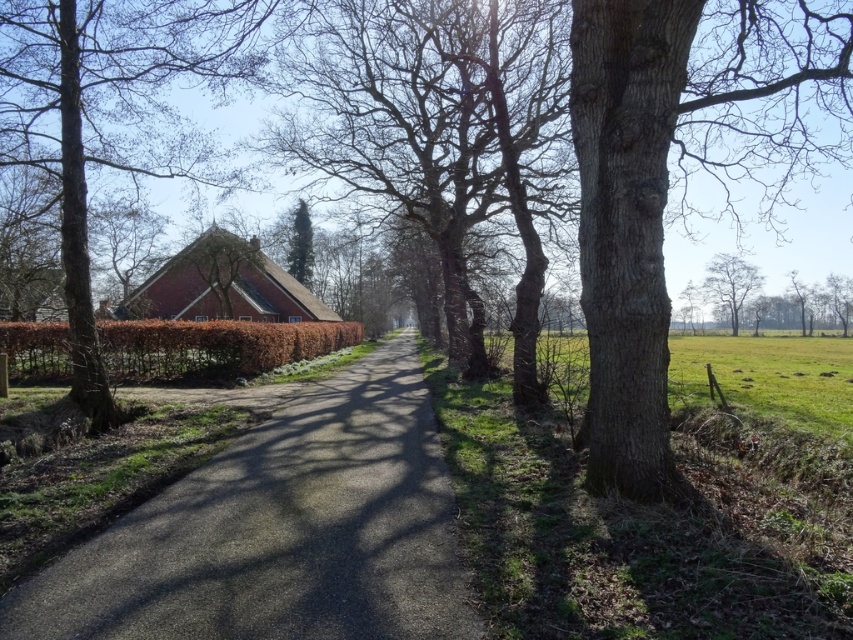
Image resolution: width=853 pixels, height=640 pixels. Identify the location of bare bark tree at center. (439, 129).

Who is lower down, bare bark tree at center or smooth bark tree at upper right?

smooth bark tree at upper right is lower down.

Who is more forward, (483, 205) or (727, 292)?

Positioned in front is point (483, 205).

In order to click on bare bark tree at center in this screenshot , I will do `click(439, 129)`.

What do you see at coordinates (439, 129) in the screenshot?
I see `bare bark tree at center` at bounding box center [439, 129].

Is bare bark tree at center closer to the viewer compared to brown rough tree at left?

No, bare bark tree at center is further to the viewer.

Is point (312, 26) closer to viewer compared to point (79, 298)?

No, (312, 26) is further to viewer.

This screenshot has width=853, height=640. I want to click on bare bark tree at center, so click(x=439, y=129).

Which is in front, point (656, 72) or point (82, 268)?

Point (656, 72)

Is point (647, 392) positioned in front of point (131, 20)?

Yes, point (647, 392) is closer to viewer.

The image size is (853, 640). I want to click on gray rough bark tree at right, so click(682, 176).